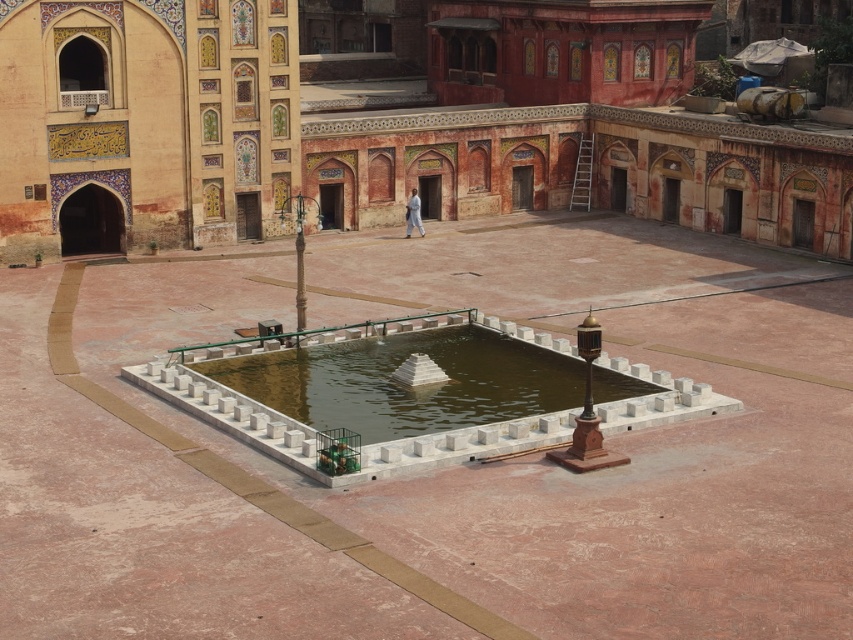
Question: Can you confirm if white marble fountain at center is bigger than smooth stone fountain at center?

Choices:
 (A) no
 (B) yes

Answer: (A)

Question: In this image, where is white marble fountain at center located relative to smooth stone fountain at center?

Choices:
 (A) below
 (B) above

Answer: (A)

Question: Among these points, which one is nearest to the camera?

Choices:
 (A) (328, 413)
 (B) (314, 595)
 (C) (186, 173)

Answer: (B)

Question: Estimate the real-world distances between objects in this image. Which object is closer to the smooth stone fountain at center?

Choices:
 (A) clear water at center
 (B) white marble fountain at center

Answer: (B)

Question: Which object is farther from the camera taking this photo?

Choices:
 (A) smooth stone fountain at center
 (B) white marble fountain at center
 (C) clear water at center

Answer: (A)

Question: Considering the relative positions of white marble fountain at center and smooth stone fountain at center in the image provided, where is white marble fountain at center located with respect to smooth stone fountain at center?

Choices:
 (A) left
 (B) right

Answer: (A)